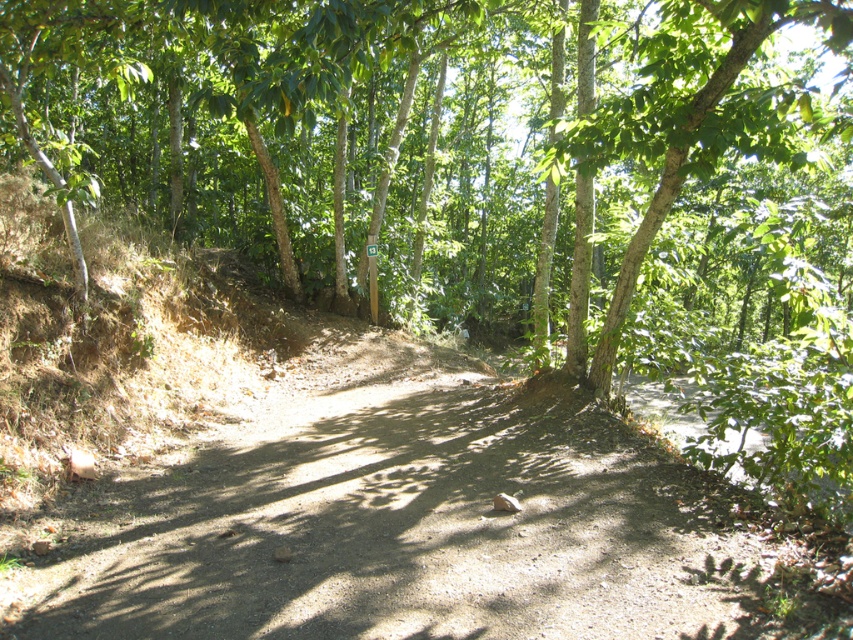
Describe the element at coordinates (408, 131) in the screenshot. This screenshot has height=640, width=853. I see `green leafy tree at center` at that location.

Does green leafy tree at center have a greater height compared to brown dirt track at center?

Indeed, green leafy tree at center has a greater height compared to brown dirt track at center.

Does point (601, 154) come farther from viewer compared to point (274, 408)?

That is False.

What are the coordinates of `green leafy tree at center` in the screenshot? It's located at (408, 131).